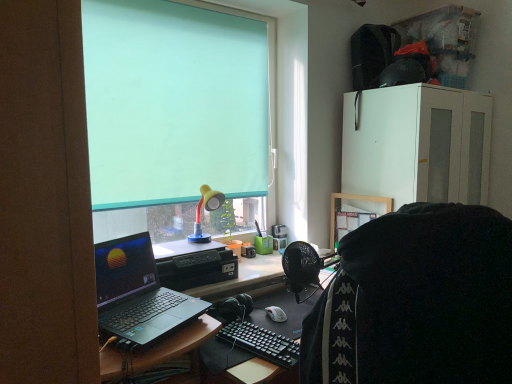
Identify the location of empty space that is ontop of teal matte/soft roller blind at upper center (from a real-world perspective). (219, 8).